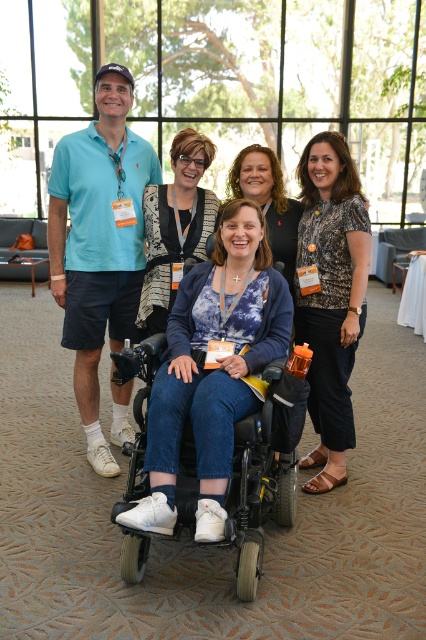
Question: Which point is closer to the camera?

Choices:
 (A) matte blue polo shirt at left
 (B) matte black wheelchair at center

Answer: (B)

Question: Is the position of printed fabric blouse at center less distant than that of matte black top at center?

Choices:
 (A) no
 (B) yes

Answer: (B)

Question: Considering the relative positions of black matte wheelchair at center and matte black wheelchair at center in the image provided, where is black matte wheelchair at center located with respect to matte black wheelchair at center?

Choices:
 (A) right
 (B) left

Answer: (B)

Question: Considering the real-world distances, which object is closest to the printed fabric blouse at center?

Choices:
 (A) matte black top at center
 (B) black matte wheelchair at center
 (C) matte blue polo shirt at left
 (D) matte black wheelchair at center

Answer: (D)

Question: Is white matte wheelchair at center further to camera compared to printed fabric blouse at center?

Choices:
 (A) no
 (B) yes

Answer: (A)

Question: Which point is farther to the camera?

Choices:
 (A) matte black top at center
 (B) printed fabric blouse at center
 (C) white matte wheelchair at center

Answer: (A)